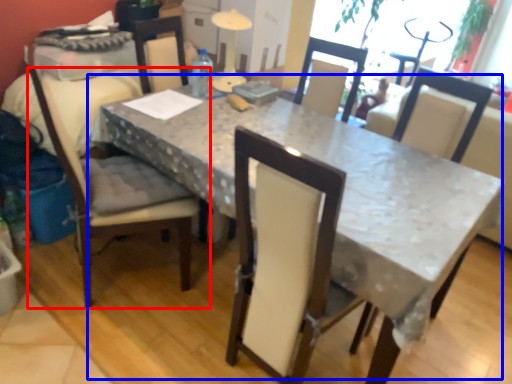
Question: Which point is closer to the camera, chair (highlighted by a red box) or table (highlighted by a blue box)?

Choices:
 (A) chair
 (B) table

Answer: (B)